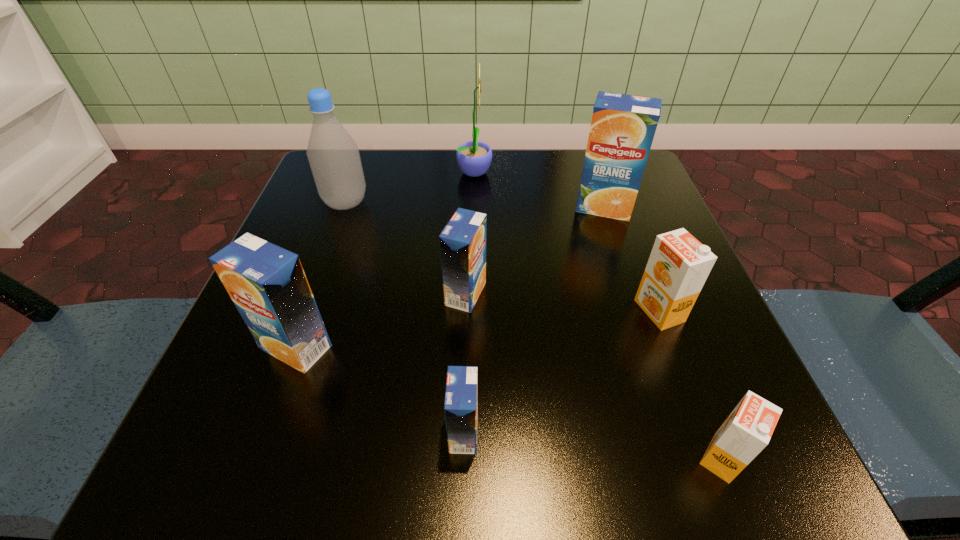
You are a GUI agent. You are given a task and a screenshot of the screen. Output one action in this format:
    pyautogui.click(x=<x>, y=<y>)
    Task: Click on the free spot between the bigger orange orange juice and the smallest blue orange_juice
    
    Given the screenshot: What is the action you would take?
    pyautogui.click(x=562, y=372)

Identify which object is the third nearest to the smaller orange orange juice. Please provide its 2D coordinates. Your answer should be formatted as a tuple, i.e. [(x, y)], where the tuple contains the x and y coordinates of a point satisfying the conditions above.

[(462, 242)]

Point out which object is positioned as the third nearest to the rightmost blue orange_juice. Please provide its 2D coordinates. Your answer should be formatted as a tuple, i.e. [(x, y)], where the tuple contains the x and y coordinates of a point satisfying the conditions above.

[(462, 242)]

Find the location of a particular element. The height and width of the screenshot is (540, 960). orange juice that is the third closest one to the farthest blue orange_juice is located at coordinates point(748,429).

Identify the location of orange juice that is the fifth closest one to the third nearest blue orange_juice. The image size is (960, 540). (748, 429).

Where is `the closest blue orange_juice to the farthest blue orange_juice`? the closest blue orange_juice to the farthest blue orange_juice is located at coordinates (462, 242).

Where is `blue orange_juice that is the fourth closest one to the bottle`? This screenshot has width=960, height=540. blue orange_juice that is the fourth closest one to the bottle is located at coordinates (461, 398).

This screenshot has height=540, width=960. What are the coordinates of `free space that satisfies the following two spatial constraints: 1. on the back side of the fifth shortest orange juice; 2. on the left side of the rightmost blue orange_juice` in the screenshot? It's located at (347, 207).

The image size is (960, 540). In order to click on vacant space that satisfies the following two spatial constraints: 1. on the front-facing side of the sunflower; 2. on the right side of the farthest blue orange_juice in this screenshot , I will do `click(474, 207)`.

This screenshot has width=960, height=540. Identify the location of vacant space that satisfies the following two spatial constraints: 1. on the front side of the second farthest blue orange_juice; 2. on the left side of the smallest blue orange_juice. (462, 433).